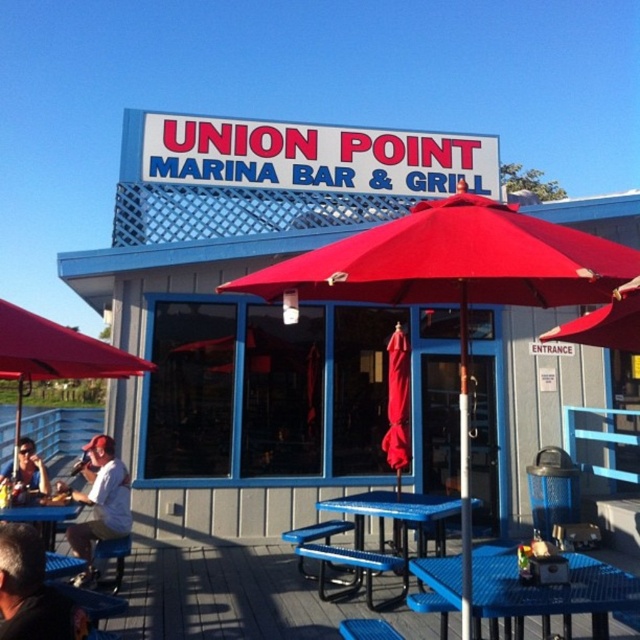
Is white shirt at lower left bigger than matte white shirt at lower left?

Incorrect, white shirt at lower left is not larger than matte white shirt at lower left.

Between white shirt at lower left and matte white shirt at lower left, which one has less height?

Standing shorter between the two is matte white shirt at lower left.

Who is more distant from viewer, [113,515] or [42,492]?

The point [42,492] is behind.

This screenshot has height=640, width=640. I want to click on white shirt at lower left, so [x=99, y=502].

Can you confirm if blue plastic table at lower right is thinner than white shirt at lower left?

Incorrect, blue plastic table at lower right's width is not less than white shirt at lower left's.

Who is lower down, blue plastic table at lower right or white shirt at lower left?

Positioned lower is white shirt at lower left.

Is point (548, 598) in front of point (99, 465)?

Yes, point (548, 598) is in front of point (99, 465).

Identify the location of blue plastic table at lower right. (548, 595).

Between point (29, 506) and point (42, 460), which one is positioned behind?

The point (42, 460) is more distant.

Find the location of `blue plastic table at lower left`. blue plastic table at lower left is located at coordinates (42, 516).

What do you see at coordinates (42, 516) in the screenshot? The height and width of the screenshot is (640, 640). I see `blue plastic table at lower left` at bounding box center [42, 516].

The height and width of the screenshot is (640, 640). Find the location of `blue plastic table at lower left`. blue plastic table at lower left is located at coordinates (42, 516).